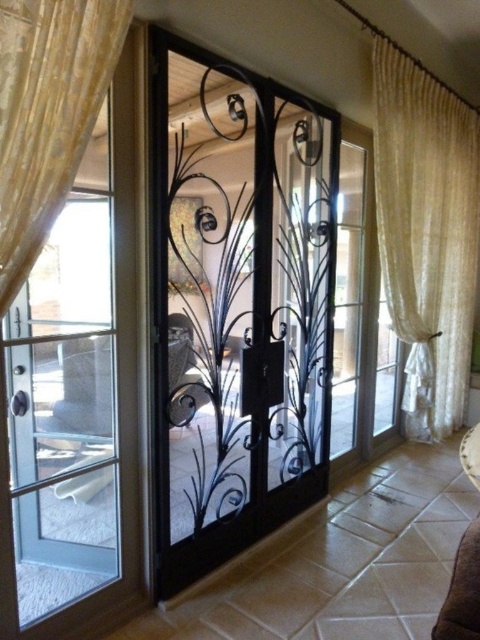
Question: Does black wrought iron screen door at center lie behind gold textured curtain at upper left?

Choices:
 (A) yes
 (B) no

Answer: (A)

Question: Considering the real-world distances, which object is farthest from the sheer white curtain at right?

Choices:
 (A) gold textured curtain at upper left
 (B) black wrought iron screen door at center

Answer: (A)

Question: Which object is farther from the camera taking this photo?

Choices:
 (A) gold textured curtain at upper left
 (B) black wrought iron screen door at center
 (C) sheer white curtain at right

Answer: (C)

Question: Which point is closer to the camera taking this photo?

Choices:
 (A) (463, 316)
 (B) (324, 372)
 (C) (57, 76)

Answer: (C)

Question: Does sheer white curtain at right appear over gold textured curtain at upper left?

Choices:
 (A) no
 (B) yes

Answer: (A)

Question: Does sheer white curtain at right have a greater width compared to gold textured curtain at upper left?

Choices:
 (A) yes
 (B) no

Answer: (A)